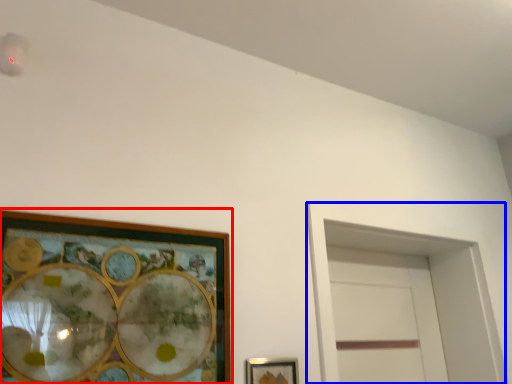
Question: Which of the following is the closest to the observer, picture frame (highlighted by a red box) or glass door (highlighted by a blue box)?

Choices:
 (A) picture frame
 (B) glass door

Answer: (A)